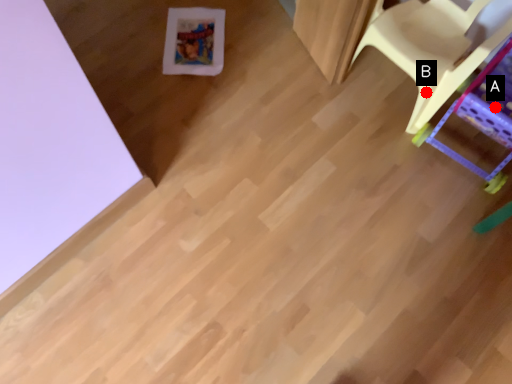
Question: Two points are circled on the image, labeled by A and B beside each circle. Which point appears farthest from the camera in this image?

Choices:
 (A) A is further
 (B) B is further

Answer: (B)